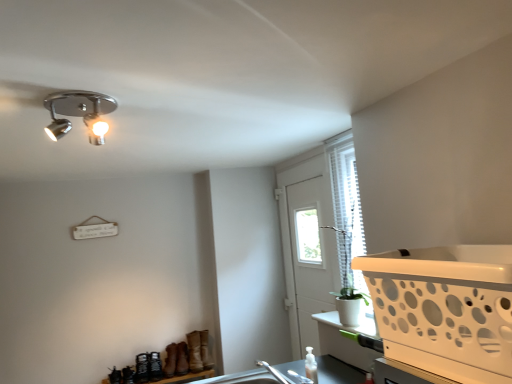
This screenshot has height=384, width=512. What do you see at coordinates (307, 246) in the screenshot?
I see `white plastic screen door at center` at bounding box center [307, 246].

This screenshot has width=512, height=384. Identify the location of translucent plastic bottle at lower center. (311, 365).

Is there a large distance between translucent plastic bottle at lower center and chrome/metallic spotlight at upper left?

Yes, translucent plastic bottle at lower center and chrome/metallic spotlight at upper left are located far from each other.

Considering the positions of objects translucent plastic bottle at lower center and chrome/metallic spotlight at upper left in the image provided, who is more to the right, translucent plastic bottle at lower center or chrome/metallic spotlight at upper left?

translucent plastic bottle at lower center.

Considering the relative sizes of translucent plastic bottle at lower center and chrome/metallic spotlight at upper left in the image provided, is translucent plastic bottle at lower center smaller than chrome/metallic spotlight at upper left?

Yes.

Does translucent plastic bottle at lower center have a larger size compared to white plastic screen door at center?

No.

Which is correct: translucent plastic bottle at lower center is inside white plastic screen door at center, or outside of it?

translucent plastic bottle at lower center lies outside white plastic screen door at center.

From a real-world perspective, is translucent plastic bottle at lower center located beneath white plastic screen door at center?

Yes, from a real-world perspective, translucent plastic bottle at lower center is under white plastic screen door at center.

Between translucent plastic bottle at lower center and white plastic basket at right, which one has less height?

With less height is translucent plastic bottle at lower center.

Considering the positions of objects translucent plastic bottle at lower center and white plastic basket at right in the image provided, who is behind, translucent plastic bottle at lower center or white plastic basket at right?

translucent plastic bottle at lower center is further from the camera.

From the image's perspective, is translucent plastic bottle at lower center located beneath white plastic basket at right?

Yes, from the image's perspective, translucent plastic bottle at lower center is below white plastic basket at right.

Can you confirm if white plastic screen door at center is positioned to the left of white plastic basket at right?

Yes, white plastic screen door at center is to the left of white plastic basket at right.

Is white plastic screen door at center inside or outside of white plastic basket at right?

white plastic screen door at center is spatially situated outside white plastic basket at right.

From their relative heights in the image, would you say white plastic screen door at center is taller or shorter than white plastic basket at right?

Considering their sizes, white plastic screen door at center has more height than white plastic basket at right.

Locate an element on the screen. screen door below the white plastic basket at right (from a real-world perspective) is located at coordinates pos(307,246).

Based on the photo, from the image's perspective, is chrome/metallic spotlight at upper left above or below translucent plastic bottle at lower center?

Clearly, from the image's perspective, chrome/metallic spotlight at upper left is above translucent plastic bottle at lower center.

Are chrome/metallic spotlight at upper left and translucent plastic bottle at lower center located far from each other?

Indeed, chrome/metallic spotlight at upper left is not near translucent plastic bottle at lower center.

Can you confirm if chrome/metallic spotlight at upper left is bigger than translucent plastic bottle at lower center?

Yes, chrome/metallic spotlight at upper left is bigger than translucent plastic bottle at lower center.

From a real-world perspective, is chrome/metallic spotlight at upper left positioned over translucent plastic bottle at lower center based on gravity?

Yes.

Which is further, (474, 265) or (286, 289)?

The point (286, 289) is farther.

Considering the relative sizes of white plastic basket at right and white plastic screen door at center in the image provided, is white plastic basket at right bigger than white plastic screen door at center?

No.

From the image's perspective, is white plastic basket at right on top of white plastic screen door at center?

Yes, from the image's perspective, white plastic basket at right is on top of white plastic screen door at center.

Would you consider white plastic basket at right to be distant from white plastic screen door at center?

white plastic basket at right is far away from white plastic screen door at center.

Is white plastic basket at right closer to the viewer compared to translucent plastic bottle at lower center?

Yes, the depth of white plastic basket at right is less than that of translucent plastic bottle at lower center.

Is white plastic basket at right facing away from translucent plastic bottle at lower center?

white plastic basket at right is not turned away from translucent plastic bottle at lower center.

Considering the relative sizes of white plastic basket at right and translucent plastic bottle at lower center in the image provided, is white plastic basket at right wider than translucent plastic bottle at lower center?

Indeed, white plastic basket at right has a greater width compared to translucent plastic bottle at lower center.

In order to click on lamp located above the translucent plastic bottle at lower center (from a real-world perspective) in this screenshot , I will do `click(79, 113)`.

Find the location of a particular element. The image size is (512, 384). screen door to the right of translucent plastic bottle at lower center is located at coordinates (307, 246).

When comparing their distances from white plastic screen door at center, does white plastic basket at right or translucent plastic bottle at lower center seem further?

The object further to white plastic screen door at center is white plastic basket at right.

Consider the image. Which object lies further to the anchor point white plastic basket at right, white plastic screen door at center or translucent plastic bottle at lower center?

white plastic screen door at center is positioned further to the anchor white plastic basket at right.

Estimate the real-world distances between objects in this image. Which object is closer to chrome/metallic spotlight at upper left, white plastic screen door at center or white plastic basket at right?

Among the two, white plastic basket at right is located nearer to chrome/metallic spotlight at upper left.

When comparing their distances from translucent plastic bottle at lower center, does white plastic basket at right or white plastic screen door at center seem further?

Among the two, white plastic basket at right is located further to translucent plastic bottle at lower center.

Estimate the real-world distances between objects in this image. Which object is further from white plastic screen door at center, chrome/metallic spotlight at upper left or translucent plastic bottle at lower center?

Among the two, chrome/metallic spotlight at upper left is located further to white plastic screen door at center.

Looking at the image, which one is located further to translucent plastic bottle at lower center, white plastic basket at right or chrome/metallic spotlight at upper left?

Among the two, chrome/metallic spotlight at upper left is located further to translucent plastic bottle at lower center.

Which object lies nearer to the anchor point white plastic screen door at center, chrome/metallic spotlight at upper left or white plastic basket at right?

white plastic basket at right is closer to white plastic screen door at center.

Estimate the real-world distances between objects in this image. Which object is closer to white plastic basket at right, chrome/metallic spotlight at upper left or white plastic screen door at center?

The object closer to white plastic basket at right is chrome/metallic spotlight at upper left.

Identify the location of bottle located between white plastic basket at right and white plastic screen door at center in the depth direction. Image resolution: width=512 pixels, height=384 pixels. (311, 365).

Find the location of a particular element. This screenshot has width=512, height=384. bottle between chrome/metallic spotlight at upper left and white plastic basket at right is located at coordinates (311, 365).

This screenshot has width=512, height=384. I want to click on lamp located between white plastic basket at right and white plastic screen door at center in the depth direction, so click(79, 113).

Locate an element on the screen. bottle positioned between chrome/metallic spotlight at upper left and white plastic screen door at center from near to far is located at coordinates (311, 365).